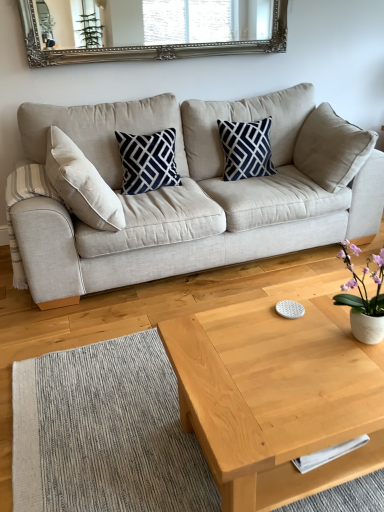
Identify the location of vacant area situated to the left side of white ceramic vase at right. (301, 346).